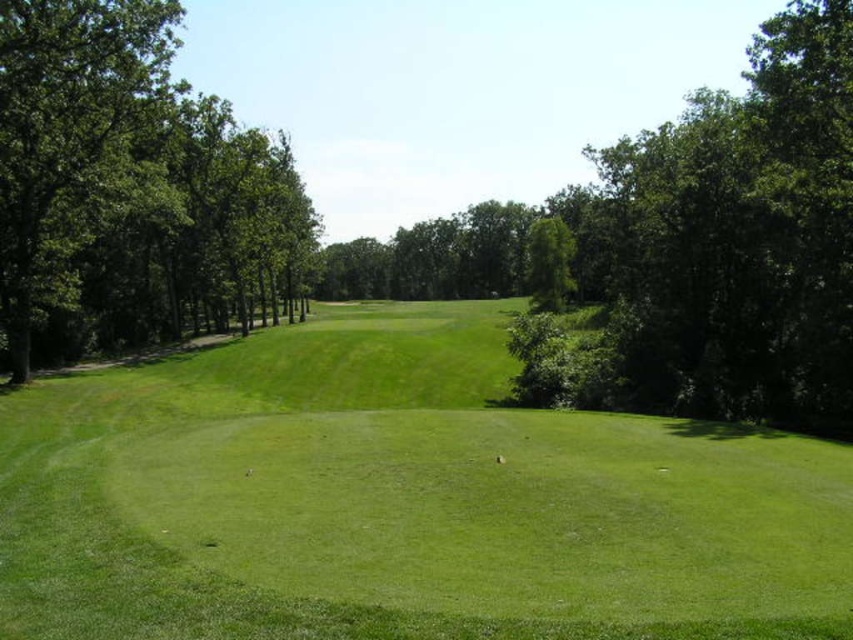
You are a golfer standing on the green grassy golf course at center and want to hit the ball towards the green leafy trees at left. Considering their widths, which area will the ball travel through first?

The ball will travel through the green grassy golf course at center first because it has a narrower width compared to the green leafy trees at left, meaning the golf course area is narrower and the ball would pass through it before entering the wider tree area.

You are a golfer standing on the green grassy golf course at center and want to hit a ball towards the green leafy trees at left. Based on the scene description, which area takes up more space in the image?

The green leafy trees at left occupy more space in the image than the green grassy golf course at center.